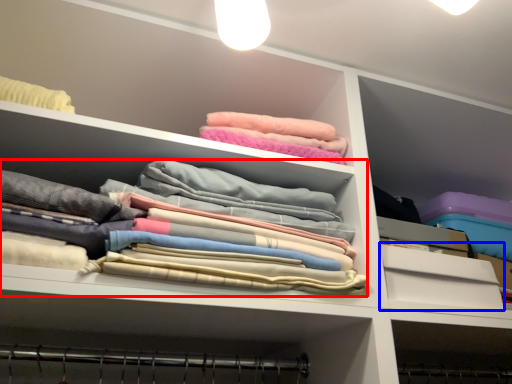
Question: Which object is closer to the camera taking this photo, clothing (highlighted by a red box) or drawer (highlighted by a blue box)?

Choices:
 (A) clothing
 (B) drawer

Answer: (A)